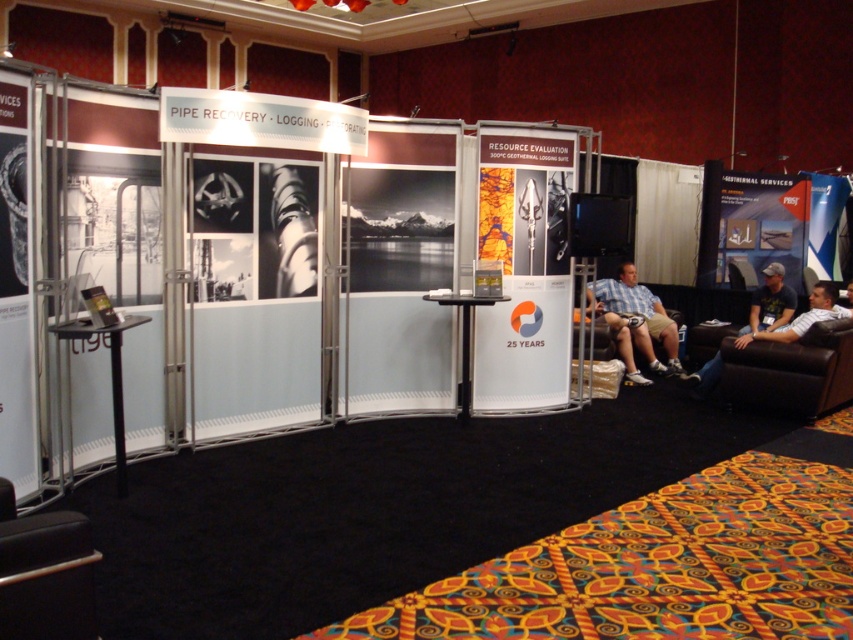
Based on the photo, you are a visitor at the trade show and want to sit down to rest. You see the black leather armchair at lower left and the dark brown leather couch at lower right. Which seating option has a greater width?

The dark brown leather couch at lower right has a greater width than the black leather armchair at lower left.

You are setting up a booth at a trade show and need to place a new banner between the matte blue poster at right and the plaid shirt shorts at right. The banner requires 1.2 meters of space. Can the banner fit between them based on their widths?

The matte blue poster at right is wider than the plaid shirt shorts at right. However, the question is about placing a banner between them, which would depend on the space between them, not their widths. The provided information only states their widths relative to each other but does not specify the distance between them. Therefore, it is impossible to determine if the banner can fit based on the given data.

You are standing at the entrance of the trade show booth and notice two points marked on the booth design. The first point is at coordinate point (x=32, y=566) and the second is at point (x=753, y=307). From your perspective, which point appears closer to you?

Point (x=32, y=566) is closer to the camera than point (x=753, y=307), so the first point appears closer to you.